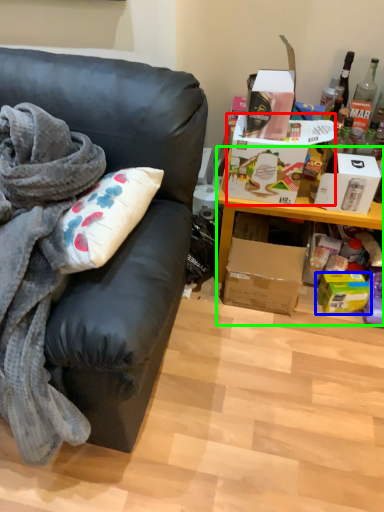
Question: Estimate the real-world distances between objects in this image. Which object is closer to box (highlighted by a red box), box (highlighted by a blue box) or cabinetry (highlighted by a green box)?

Choices:
 (A) box
 (B) cabinetry

Answer: (B)